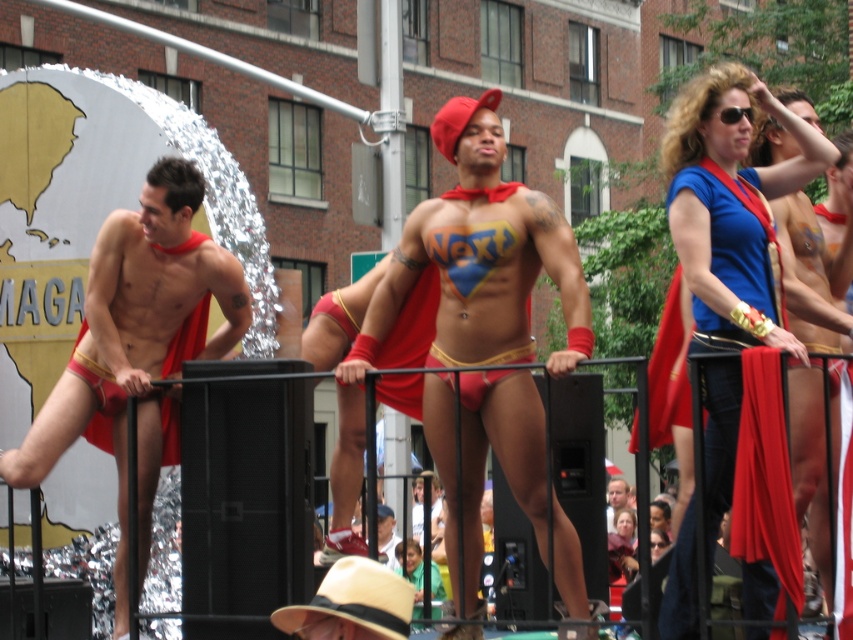
Which is below, matte red underwear at center or matte red cape at center?

matte red cape at center

Does matte red underwear at center come in front of matte red cape at center?

Yes, it is in front of matte red cape at center.

Is point (474, 330) more distant than point (611, 477)?

That is False.

Where is `matte red underwear at center`? matte red underwear at center is located at coordinates (479, 259).

Where is `matte red underwear at center`? The height and width of the screenshot is (640, 853). matte red underwear at center is located at coordinates (479, 259).

The width and height of the screenshot is (853, 640). Describe the element at coordinates (479, 259) in the screenshot. I see `matte red underwear at center` at that location.

Find the location of `matte red underwear at center`. matte red underwear at center is located at coordinates tap(479, 259).

Does matte gold underwear at left have a lesser width compared to blue fabric cape at upper right?

Yes.

Between matte gold underwear at left and blue fabric cape at upper right, which one has less height?

Standing shorter between the two is matte gold underwear at left.

Is point (132, 272) closer to camera compared to point (727, 394)?

No, it is behind (727, 394).

Find the location of a particular element. This screenshot has width=853, height=640. matte gold underwear at left is located at coordinates (137, 348).